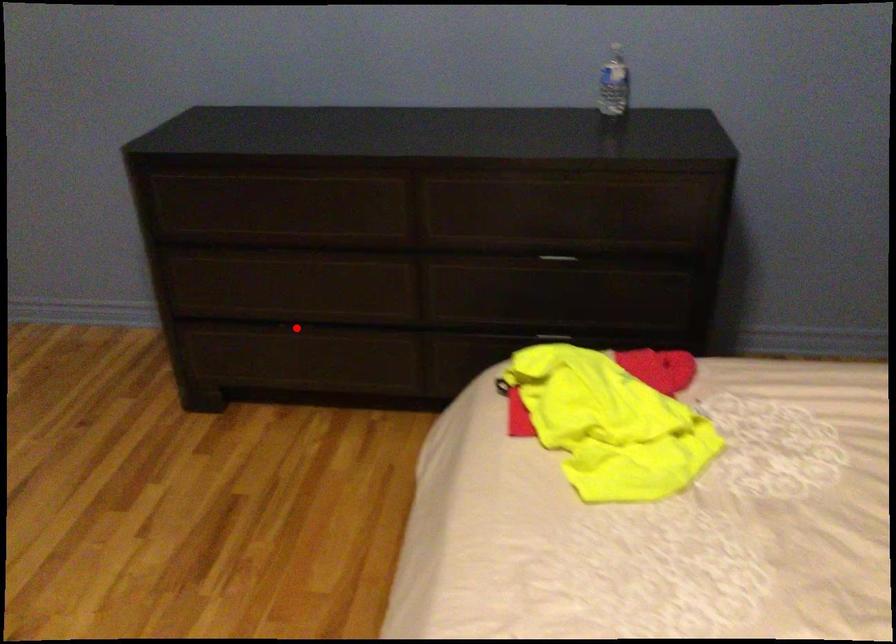
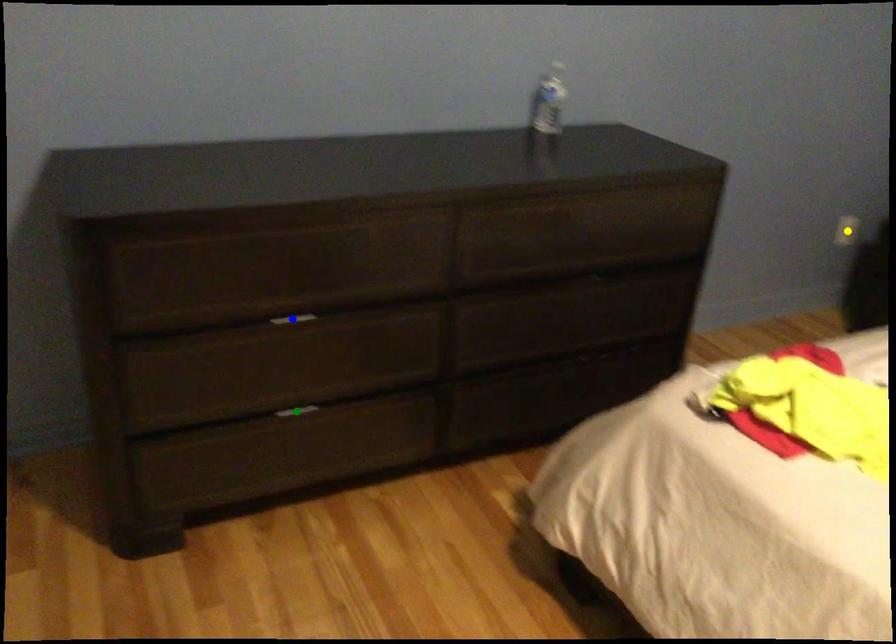
Question: I am providing you with two images of the same scene from different viewpoints. A red point is marked on the first image. You are given multiple points on the second image. In image 2, which mark is for the same physical point as the one in image 1?

Choices:
 (A) yellow point
 (B) green point
 (C) blue point

Answer: (B)